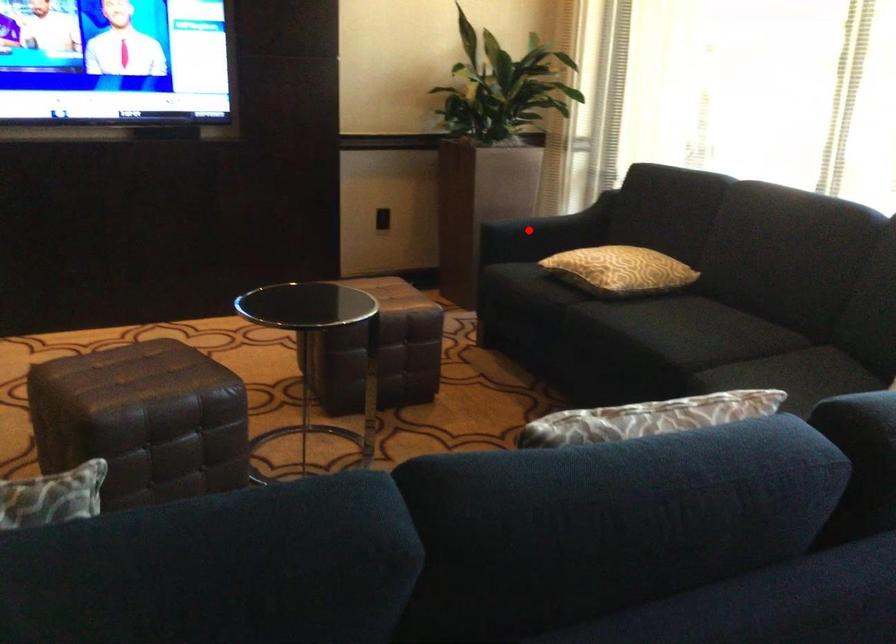
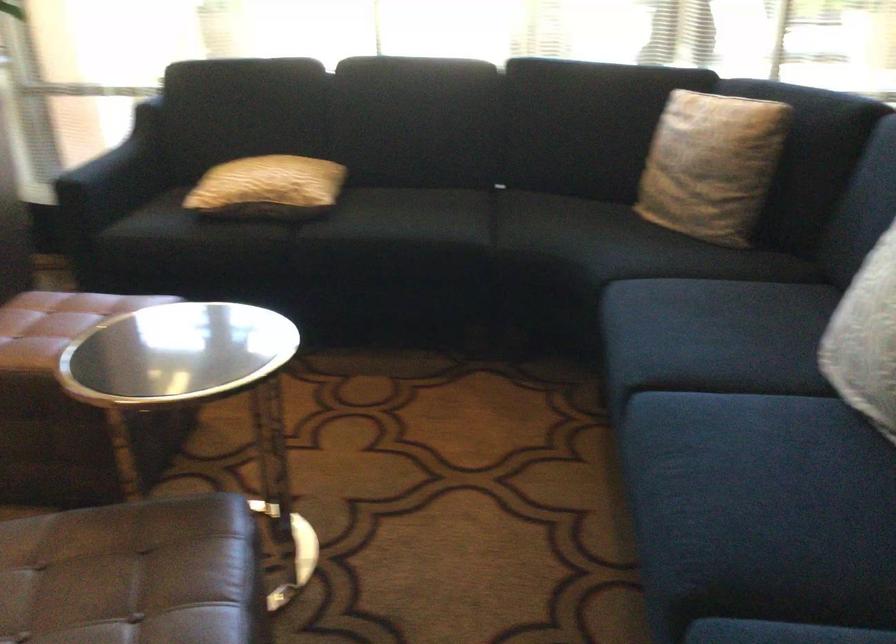
Find the pixel in the second image that matches the highlighted location in the first image.

(115, 176)